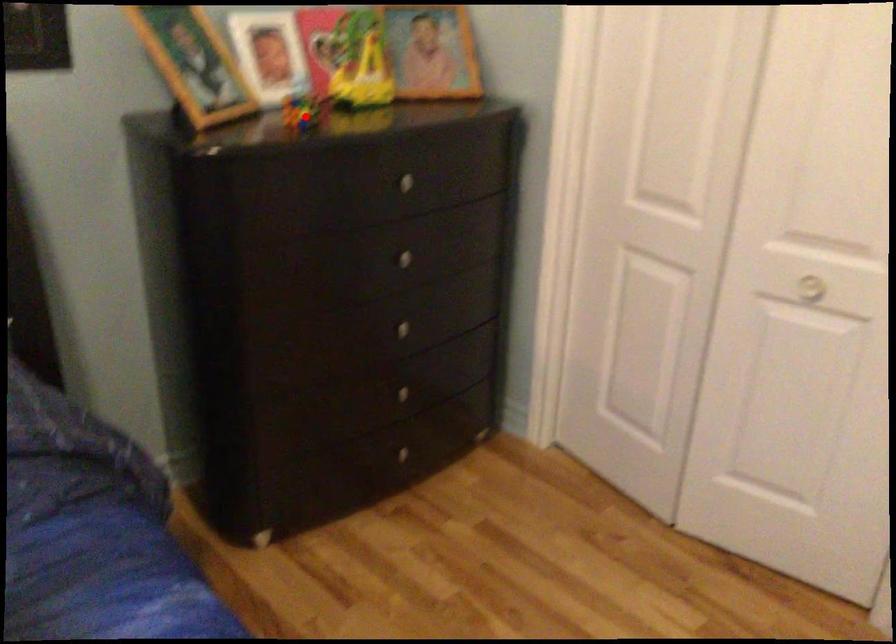
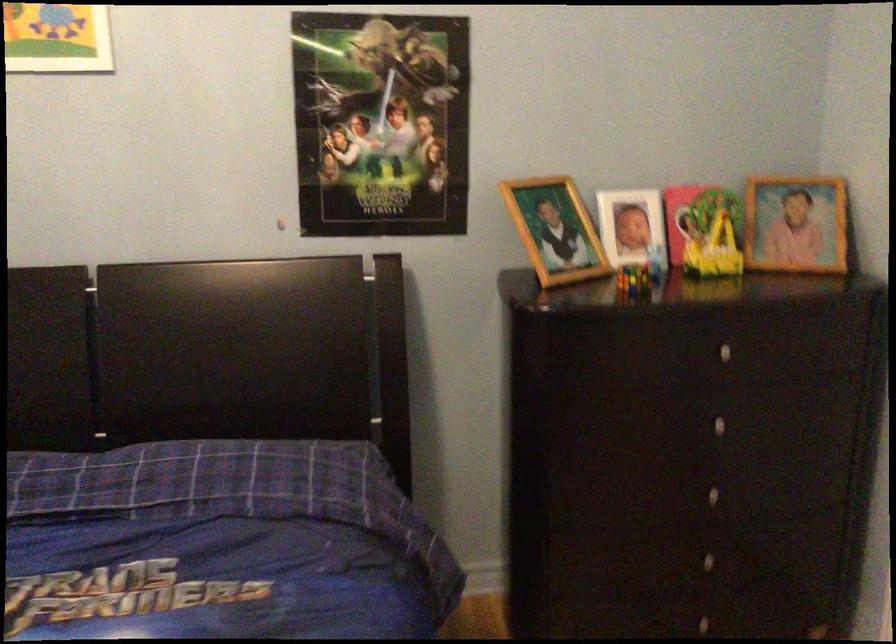
The point at the highlighted location is marked in the first image. Where is the corresponding point in the second image?

(634, 279)